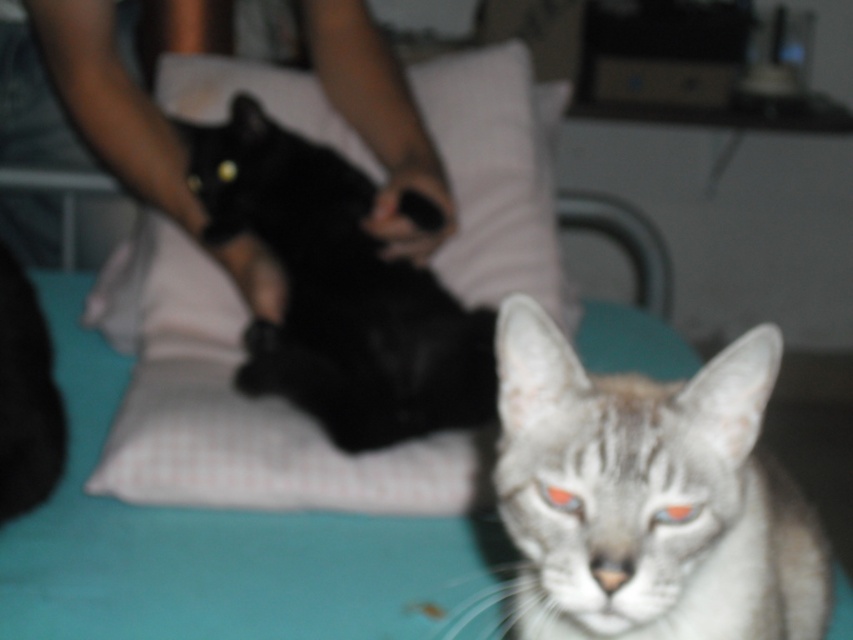
Question: Is white fur cat at center smaller than shiny orange eye at center?

Choices:
 (A) no
 (B) yes

Answer: (A)

Question: Based on their relative distances, which object is nearer to the white fur cat at center?

Choices:
 (A) white checkered pillow at upper center
 (B) shiny black cat at center
 (C) shiny blue eye at center

Answer: (C)

Question: From the image, what is the correct spatial relationship of white fur cat at center in relation to shiny orange eye at center?

Choices:
 (A) above
 (B) below

Answer: (B)

Question: Which point is closer to the camera?

Choices:
 (A) white checkered pillow at upper center
 (B) shiny black cat at center
 (C) white fur cat at center
 (D) shiny blue eye at center

Answer: (C)

Question: Is white fur cat at center further to the viewer compared to shiny blue eye at center?

Choices:
 (A) yes
 (B) no

Answer: (B)

Question: Considering the real-world distances, which object is closest to the white checkered pillow at upper center?

Choices:
 (A) shiny orange eye at center
 (B) shiny black cat at center
 (C) shiny blue eye at center
 (D) white fur cat at center

Answer: (B)